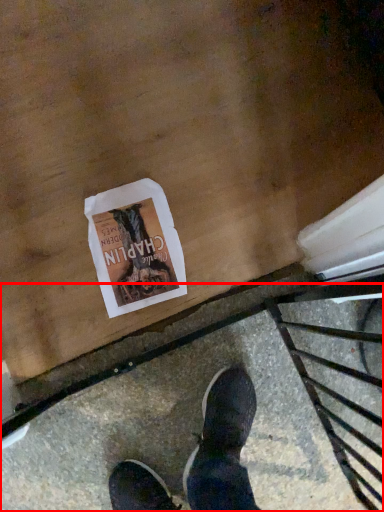
Question: From the image's perspective, where is pavement (annotated by the red box) located relative to flyer?

Choices:
 (A) below
 (B) above

Answer: (A)